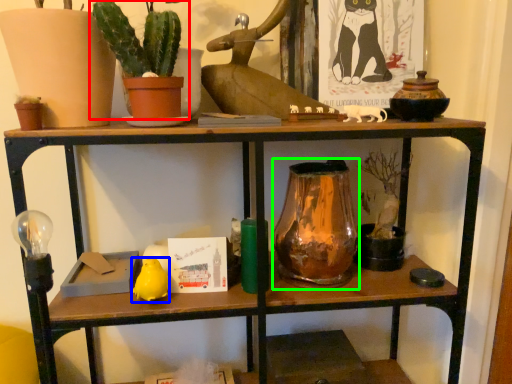
Question: Estimate the real-world distances between objects in this image. Which object is farther from houseplant (highlighted by a red box), animal (highlighted by a blue box) or glass vase (highlighted by a green box)?

Choices:
 (A) animal
 (B) glass vase

Answer: (A)